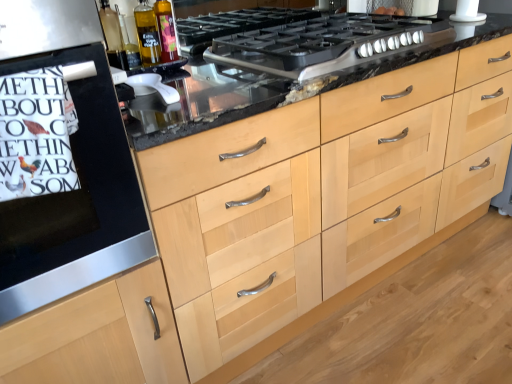
Question: Is there a large distance between white plastic juicer at center, the first appliance in the front-to-back sequence, and white matte plastic pipe at upper right, arranged as the first appliance when viewed from the right?

Choices:
 (A) yes
 (B) no

Answer: (A)

Question: Is white plastic juicer at center, which appears as the second appliance when viewed from the top, facing away from white matte plastic pipe at upper right, which is counted as the 2th appliance, starting from the front?

Choices:
 (A) yes
 (B) no

Answer: (B)

Question: Does white plastic juicer at center, which is the 2th appliance from back to front, have a lesser width compared to white matte plastic pipe at upper right, which is the 2th appliance in left-to-right order?

Choices:
 (A) no
 (B) yes

Answer: (A)

Question: Is the position of white plastic juicer at center, arranged as the first appliance when viewed from the left, less distant than that of white matte plastic pipe at upper right, positioned as the first appliance in top-to-bottom order?

Choices:
 (A) yes
 (B) no

Answer: (A)

Question: From a real-world perspective, is white plastic juicer at center, arranged as the first appliance when viewed from the left, physically below white matte plastic pipe at upper right, positioned as the first appliance in top-to-bottom order?

Choices:
 (A) no
 (B) yes

Answer: (B)

Question: From a real-world perspective, relative to black matte gas stove at center, is white paper towel at left vertically above or below?

Choices:
 (A) above
 (B) below

Answer: (A)

Question: From the image's perspective, is white paper towel at left above or below black matte gas stove at center?

Choices:
 (A) above
 (B) below

Answer: (B)

Question: Do you think white paper towel at left is within black matte gas stove at center, or outside of it?

Choices:
 (A) inside
 (B) outside

Answer: (B)

Question: In terms of height, does white paper towel at left look taller or shorter compared to black matte gas stove at center?

Choices:
 (A) short
 (B) tall

Answer: (B)

Question: Is translucent glass bottle at upper left, the second bottle in the left-to-right sequence, wider or thinner than white paper towel at left?

Choices:
 (A) thin
 (B) wide

Answer: (A)

Question: Based on their sizes in the image, would you say translucent glass bottle at upper left, which is the first bottle from right to left, is bigger or smaller than white paper towel at left?

Choices:
 (A) big
 (B) small

Answer: (B)

Question: Is translucent glass bottle at upper left, which is the first bottle from right to left, in front of or behind white paper towel at left in the image?

Choices:
 (A) behind
 (B) front

Answer: (A)

Question: From a real-world perspective, is translucent glass bottle at upper left, which is the first bottle from right to left, positioned above or below white paper towel at left?

Choices:
 (A) above
 (B) below

Answer: (A)

Question: Considering the positions of white paper towel at left and white plastic juicer at center, which appears as the second appliance when viewed from the top, in the image, is white paper towel at left wider or thinner than white plastic juicer at center, which appears as the second appliance when viewed from the top,?

Choices:
 (A) thin
 (B) wide

Answer: (A)

Question: From a real-world perspective, relative to white plastic juicer at center, the second appliance from the right, is white paper towel at left vertically above or below?

Choices:
 (A) above
 (B) below

Answer: (A)